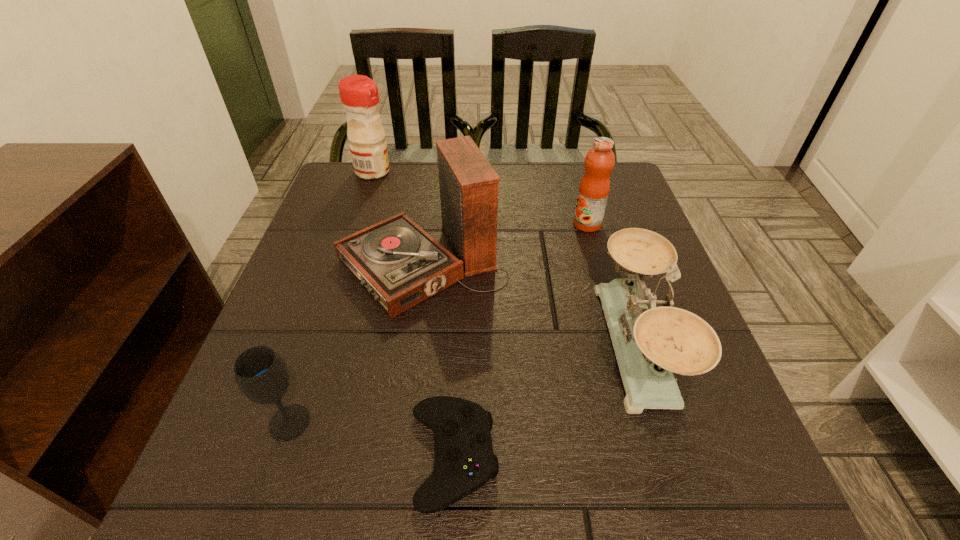
You are a GUI agent. You are given a task and a screenshot of the screen. Output one action in this format:
    pyautogui.click(x=<x>, y=<y>)
    Task: Click on the condiment
    
    Given the screenshot: What is the action you would take?
    pyautogui.click(x=359, y=94)

Image resolution: width=960 pixels, height=540 pixels. I want to click on phonograph record, so click(x=401, y=265).

Locate an element on the screen. fruit juice is located at coordinates (594, 188).

Image resolution: width=960 pixels, height=540 pixels. In order to click on scale in this screenshot , I will do point(651,344).

Identify the location of the second shortest object. (261, 374).

Locate an element on the screen. control is located at coordinates (465, 461).

Where is `free region located 0.310m on the front of the farthest object`? free region located 0.310m on the front of the farthest object is located at coordinates [x=345, y=256].

Locate an element on the screen. Image resolution: width=960 pixels, height=540 pixels. vacant space positioned 0.280m on the right of the phonograph record is located at coordinates (637, 266).

Find the location of a particular element. free region located on the front label of the fruit juice is located at coordinates (468, 224).

The width and height of the screenshot is (960, 540). I want to click on vacant region located 0.390m on the front label of the fruit juice, so click(410, 224).